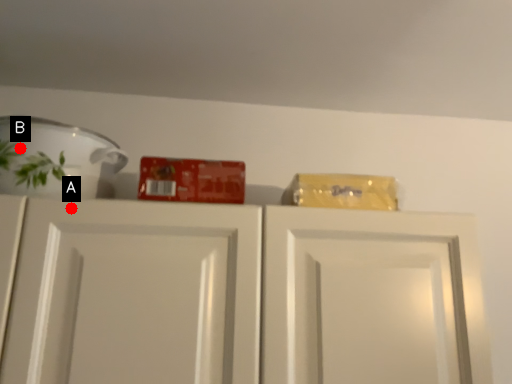
Question: Two points are circled on the image, labeled by A and B beside each circle. Which point is farther to the camera?

Choices:
 (A) A is further
 (B) B is further

Answer: (B)